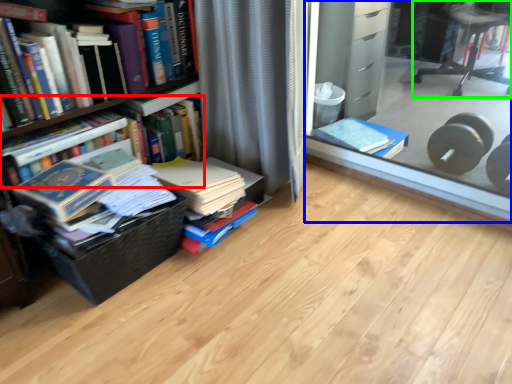
Question: Which object is the farthest from book (highlighted by a red box)? Choose among these: glass box (highlighted by a blue box) or chair (highlighted by a green box).

Choices:
 (A) glass box
 (B) chair

Answer: (B)